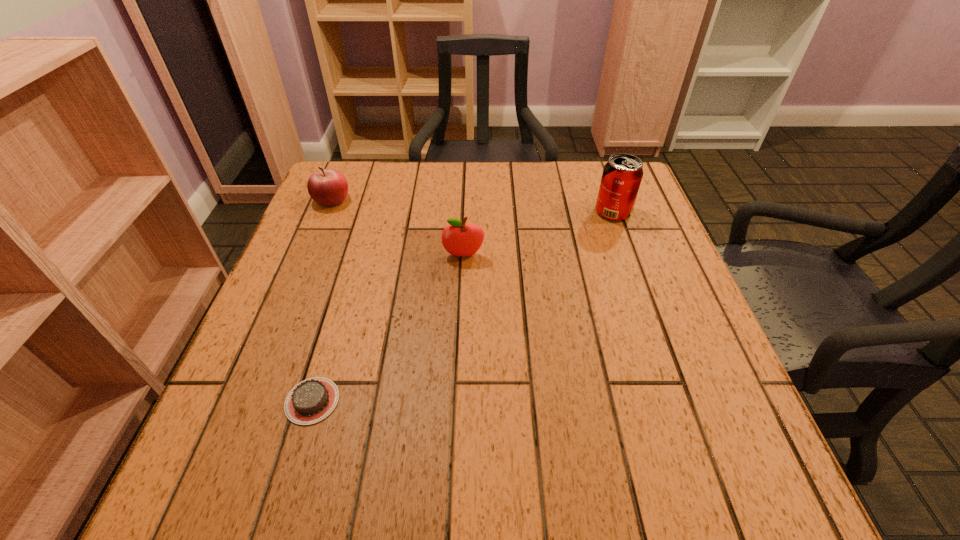
In order to click on free space at the near edge of the desktop in this screenshot , I will do `click(659, 500)`.

At what (x,y) coordinates should I click in order to perform the action: click on vacant space at the left edge of the desktop. Please return your answer as a coordinate pair (x, y). This screenshot has width=960, height=540. Looking at the image, I should click on (264, 438).

Locate an element on the screen. The image size is (960, 540). vacant space at the right edge is located at coordinates (637, 268).

The image size is (960, 540). I want to click on blank space at the far left corner of the desktop, so point(370,183).

Image resolution: width=960 pixels, height=540 pixels. In order to click on free region at the near left corner of the desktop in this screenshot , I will do `click(177, 496)`.

This screenshot has width=960, height=540. What are the coordinates of `free spot between the tallest object and the third farthest object` in the screenshot? It's located at (539, 234).

You are a GUI agent. You are given a task and a screenshot of the screen. Output one action in this format:
    pyautogui.click(x=<x>, y=<y>)
    Task: Click on the unoccupied position between the farther apple and the tallest object
    The width and height of the screenshot is (960, 540).
    Given the screenshot: What is the action you would take?
    click(x=472, y=206)

Find the location of `vacant area between the nearest object and the shorter apple`. vacant area between the nearest object and the shorter apple is located at coordinates (322, 300).

This screenshot has width=960, height=540. In order to click on vacant point located between the shorter apple and the second object from right to left in this screenshot , I will do `click(397, 227)`.

You are a GUI agent. You are given a task and a screenshot of the screen. Output one action in this format:
    pyautogui.click(x=<x>, y=<y>)
    Task: Click on the free space between the chocolate cake and the rightmost object
    The width and height of the screenshot is (960, 540).
    Given the screenshot: What is the action you would take?
    pyautogui.click(x=463, y=306)